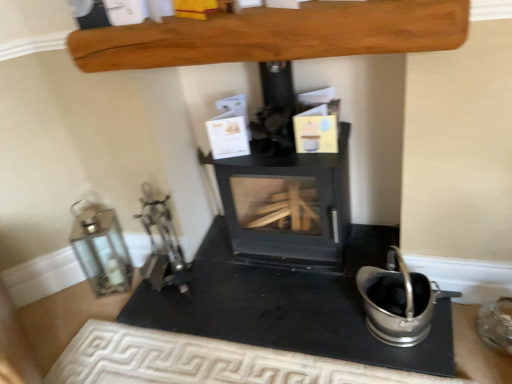
At what (x,y) coordinates should I click in order to perform the action: click on vacant space in smooth wooden beam at upper center (from a real-world perspective). Please return your answer as a coordinate pair (x, y). The width and height of the screenshot is (512, 384). Looking at the image, I should click on (263, 277).